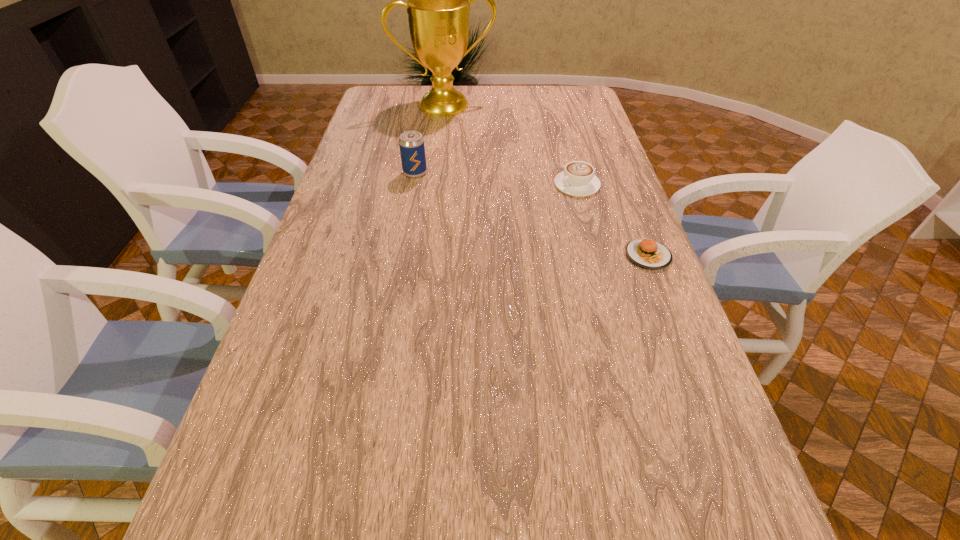
Identify the location of empty location between the award and the nearest object. The image size is (960, 540). (547, 180).

The image size is (960, 540). I want to click on vacant point located between the third tallest object and the beer can, so click(x=496, y=179).

The image size is (960, 540). I want to click on free space between the shortest object and the tallest object, so click(x=547, y=180).

This screenshot has height=540, width=960. I want to click on free space that is in between the farthest object and the shortest object, so click(x=547, y=180).

Find the location of a particular element. Image resolution: width=960 pixels, height=540 pixels. empty location between the cappuccino and the tallest object is located at coordinates (512, 145).

Point out which object is positioned as the second nearest to the cappuccino. Please provide its 2D coordinates. Your answer should be formatted as a tuple, i.e. [(x, y)], where the tuple contains the x and y coordinates of a point satisfying the conditions above.

[(411, 143)]

At what (x,y) coordinates should I click in order to perform the action: click on the second closest object relative to the beer can. Please return your answer as a coordinate pair (x, y). This screenshot has height=540, width=960. Looking at the image, I should click on (578, 179).

This screenshot has height=540, width=960. What are the coordinates of `blank space that satisfies the following two spatial constraints: 1. on the front side of the beer can; 2. on the left side of the third object from left to right` in the screenshot? It's located at (413, 185).